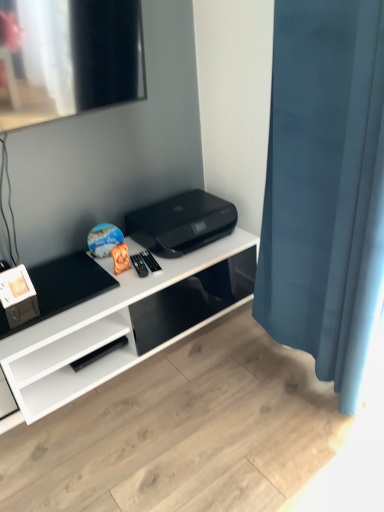
You are a GUI agent. You are given a task and a screenshot of the screen. Output one action in this format:
    pyautogui.click(x=<x>, y=<y>)
    Task: Click on the vacant region below blue velvet curtain at right (from a real-world perspective)
    This screenshot has height=512, width=384.
    Given the screenshot: What is the action you would take?
    pyautogui.click(x=291, y=364)